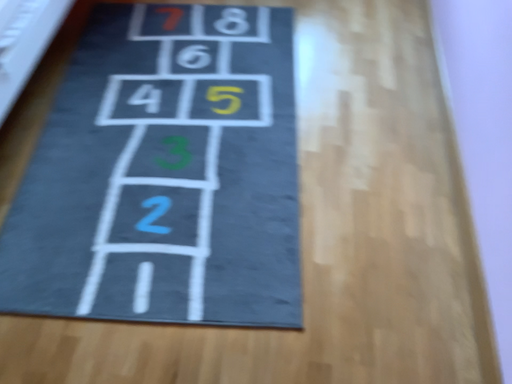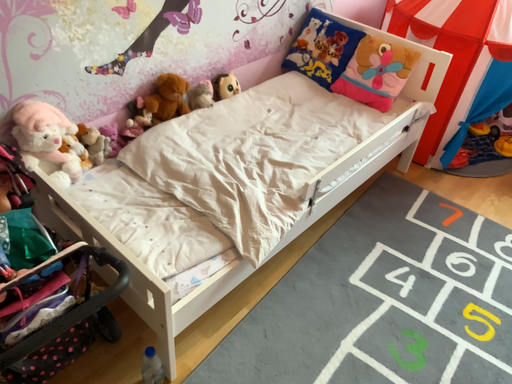
Question: How did the camera likely rotate when shooting the video?

Choices:
 (A) rotated downward
 (B) rotated upward

Answer: (B)